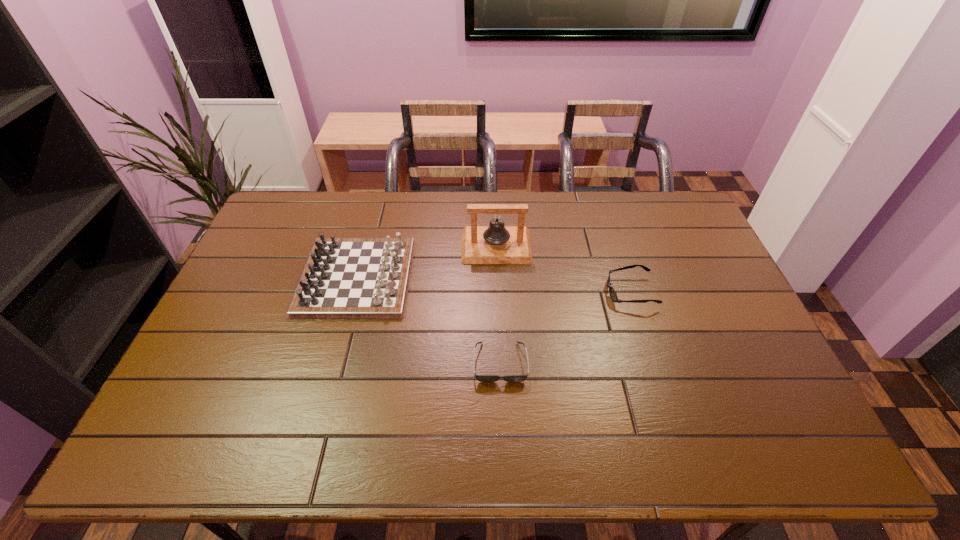
Identify the location of free location that satisfies the following two spatial constraints: 1. on the front side of the bell; 2. from the player's perspective of the chessboard. (497, 277).